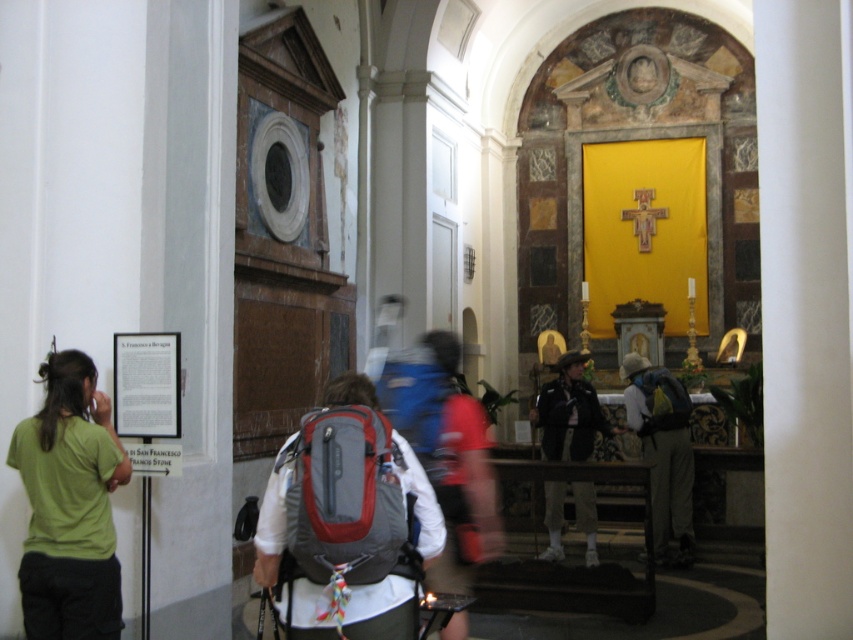
Measure the distance between gray fabric backpack at center and camera.

→ gray fabric backpack at center is 9.23 meters away from camera.

What are the coordinates of `gray fabric backpack at center` in the screenshot? It's located at (346, 522).

Is green matte shirt at left to the left of red fabric backpack at center from the viewer's perspective?

Indeed, green matte shirt at left is positioned on the left side of red fabric backpack at center.

Is green matte shirt at left in front of red fabric backpack at center?

No, it is not.

Who is more forward, (80,372) or (374,506)?

Point (374,506) is more forward.

Locate an element on the screen. green matte shirt at left is located at coordinates (68, 506).

Image resolution: width=853 pixels, height=640 pixels. Identify the location of red fabric backpack at center. point(346,500).

Which is in front, point (286, 490) or point (399, 376)?

Point (286, 490) is in front.

The height and width of the screenshot is (640, 853). I want to click on red fabric backpack at center, so click(346, 500).